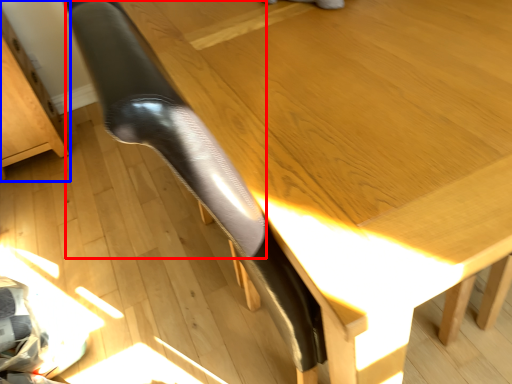
Question: Which object is further to the camera taking this photo, leg (highlighted by a red box) or furniture (highlighted by a blue box)?

Choices:
 (A) leg
 (B) furniture

Answer: (B)